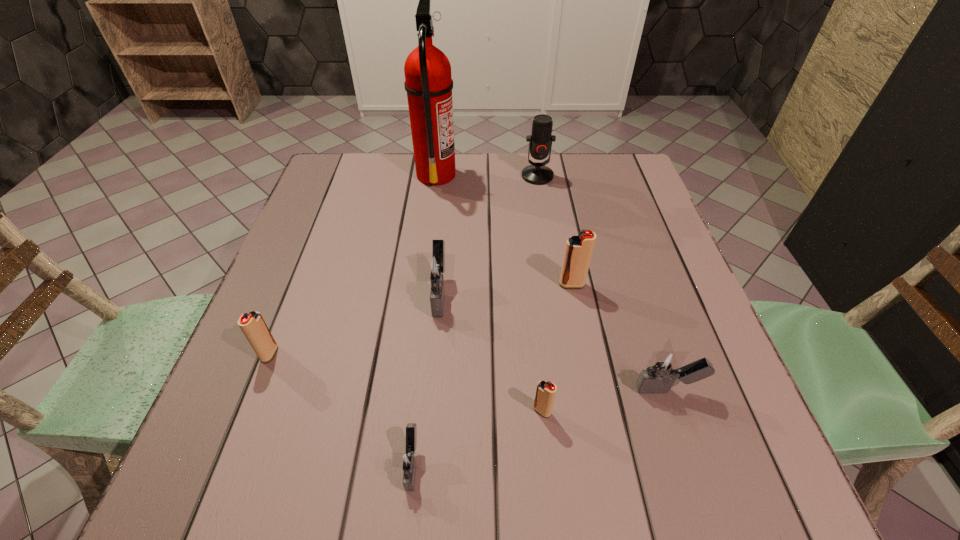
In order to click on vacant area that lies between the second red igniter from right to left and the red microphone in this screenshot , I will do `click(540, 293)`.

Where is `vacant space in between the microphone and the fifth farthest object`? vacant space in between the microphone and the fifth farthest object is located at coordinates (403, 265).

What are the coordinates of `the second closest object to the farthest red igniter` in the screenshot? It's located at (437, 267).

The image size is (960, 540). Identify the location of object that can be found as the sixth closest to the tallest object. (664, 367).

Locate which igniter ranks second in proximity to the rightmost red igniter. Please provide its 2D coordinates. Your answer should be formatted as a tuple, i.e. [(x, y)], where the tuple contains the x and y coordinates of a point satisfying the conditions above.

[(437, 267)]

Locate an element on the screen. This screenshot has width=960, height=540. igniter that is the fourth closest one to the rightmost igniter is located at coordinates (409, 461).

Where is `red igniter that is the second closest to the smallest red igniter`? red igniter that is the second closest to the smallest red igniter is located at coordinates (253, 326).

Where is `the second closest red igniter relative to the fifth igniter from left to right`? This screenshot has height=540, width=960. the second closest red igniter relative to the fifth igniter from left to right is located at coordinates (253, 326).

The image size is (960, 540). Identify the location of the second closest gray igniter to the farthest red igniter. (437, 267).

At what (x,y) coordinates should I click in order to perform the action: click on the closest gray igniter relative to the microphone. Please return your answer as a coordinate pair (x, y). This screenshot has height=540, width=960. Looking at the image, I should click on (437, 267).